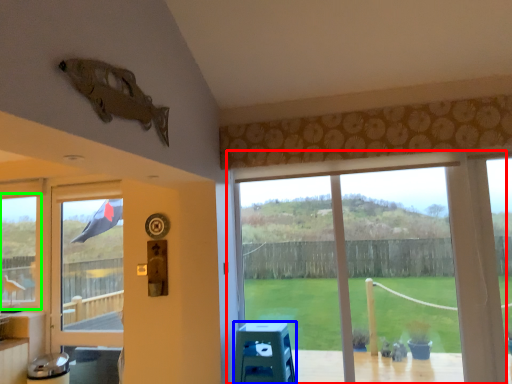
Question: Estimate the real-world distances between objects in this image. Which object is closer to window (highlighted by a red box), stool (highlighted by a blue box) or window (highlighted by a green box)?

Choices:
 (A) stool
 (B) window

Answer: (A)